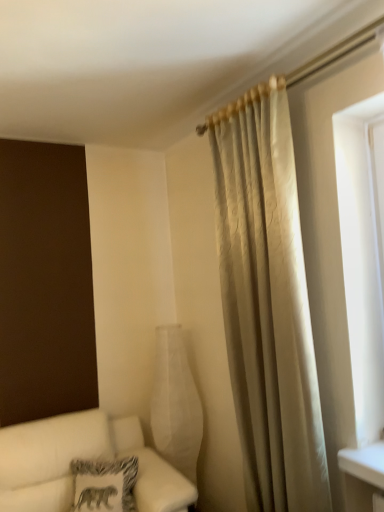
Question: Does white fabric couch at lower left come in front of white matte glass vase at center?

Choices:
 (A) no
 (B) yes

Answer: (B)

Question: Is white fabric couch at lower left positioned beyond the bounds of white matte glass vase at center?

Choices:
 (A) no
 (B) yes

Answer: (B)

Question: Does white fabric couch at lower left have a greater height compared to white matte glass vase at center?

Choices:
 (A) yes
 (B) no

Answer: (B)

Question: Is white matte glass vase at center completely or partially inside white fabric couch at lower left?

Choices:
 (A) no
 (B) yes

Answer: (A)

Question: Does white fabric couch at lower left turn towards white matte glass vase at center?

Choices:
 (A) yes
 (B) no

Answer: (B)

Question: Can you confirm if white fabric couch at lower left is shorter than white matte glass vase at center?

Choices:
 (A) yes
 (B) no

Answer: (A)

Question: From a real-world perspective, is patterned fabric pillow at lower left below white fabric couch at lower left?

Choices:
 (A) no
 (B) yes

Answer: (A)

Question: Is white fabric couch at lower left surrounded by patterned fabric pillow at lower left?

Choices:
 (A) no
 (B) yes

Answer: (A)

Question: From the image's perspective, would you say patterned fabric pillow at lower left is shown under white fabric couch at lower left?

Choices:
 (A) yes
 (B) no

Answer: (B)

Question: Is patterned fabric pillow at lower left oriented away from white fabric couch at lower left?

Choices:
 (A) no
 (B) yes

Answer: (B)

Question: Does patterned fabric pillow at lower left have a greater height compared to white fabric couch at lower left?

Choices:
 (A) yes
 (B) no

Answer: (B)

Question: Is patterned fabric pillow at lower left at the left side of white fabric couch at lower left?

Choices:
 (A) no
 (B) yes

Answer: (B)

Question: Does white fabric couch at lower left appear on the right side of patterned fabric pillow at lower left?

Choices:
 (A) no
 (B) yes

Answer: (B)